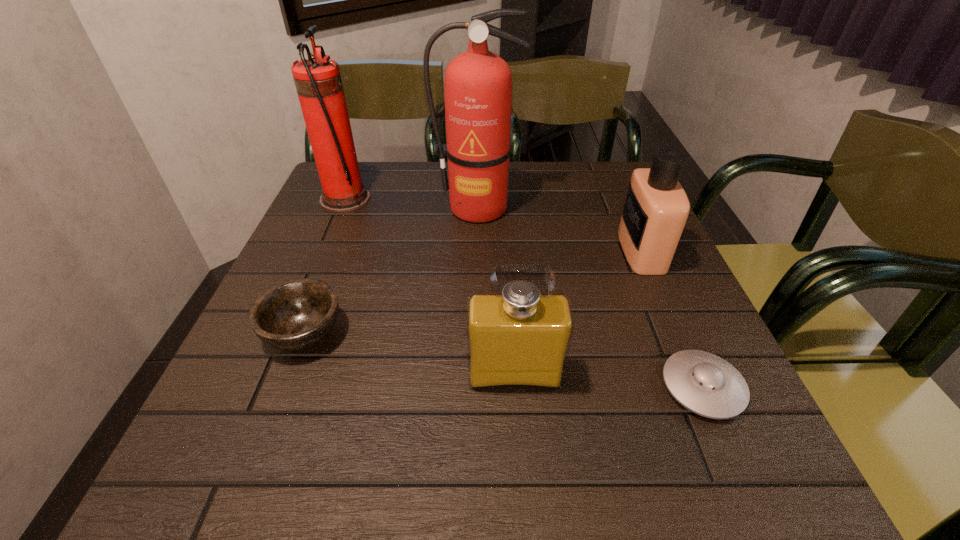
Where is `the right fire extinguisher`? the right fire extinguisher is located at coordinates (478, 83).

At what (x,y) coordinates should I click in order to perform the action: click on the left fire extinguisher. Please return your answer as a coordinate pair (x, y). Image resolution: width=960 pixels, height=540 pixels. Looking at the image, I should click on (318, 82).

Find the location of a particular element. the third farthest object is located at coordinates (656, 208).

Locate an element on the screen. This screenshot has height=540, width=960. the farther perfume is located at coordinates (656, 208).

Locate an element on the screen. The width and height of the screenshot is (960, 540). the left perfume is located at coordinates click(x=519, y=336).

In order to click on the second shortest object in this screenshot , I will do `click(297, 314)`.

You are a GUI agent. You are given a task and a screenshot of the screen. Output one action in this format:
    pyautogui.click(x=<x>, y=<y>)
    Task: Click on the shortest object
    The width and height of the screenshot is (960, 540).
    Given the screenshot: What is the action you would take?
    pyautogui.click(x=704, y=383)

This screenshot has width=960, height=540. I want to click on free location located 0.200m on the side of the right fire extinguisher with the nozzle and handle, so click(x=476, y=280).

The image size is (960, 540). I want to click on free space located at the discharge end of the left fire extinguisher, so click(x=415, y=199).

Identify the location of vacant area situated 0.390m on the front label of the third farthest object. (452, 251).